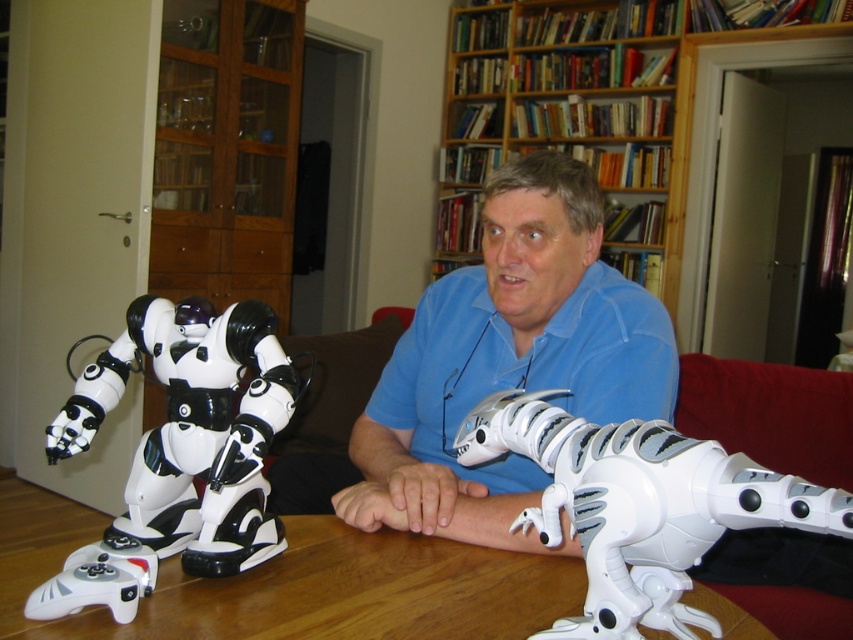
Question: Which object appears closest to the camera in this image?

Choices:
 (A) white matte robot at left
 (B) blue matte shirt at center
 (C) wooden table at lower center
 (D) white matte dinosaur at lower right

Answer: (D)

Question: Which object is positioned closest to the blue matte shirt at center?

Choices:
 (A) white matte robot at left
 (B) wooden table at lower center
 (C) wooden bookshelf at upper center

Answer: (B)

Question: Does white matte dinosaur at lower right appear on the left side of wooden bookshelf at upper center?

Choices:
 (A) yes
 (B) no

Answer: (A)

Question: Estimate the real-world distances between objects in this image. Which object is closer to the white matte dinosaur at lower right?

Choices:
 (A) blue matte shirt at center
 (B) white matte robot at left
 (C) wooden bookshelf at upper center

Answer: (B)

Question: Is wooden table at lower center further to camera compared to wooden bookshelf at upper center?

Choices:
 (A) yes
 (B) no

Answer: (B)

Question: Can you confirm if wooden table at lower center is bigger than wooden bookshelf at upper center?

Choices:
 (A) no
 (B) yes

Answer: (A)